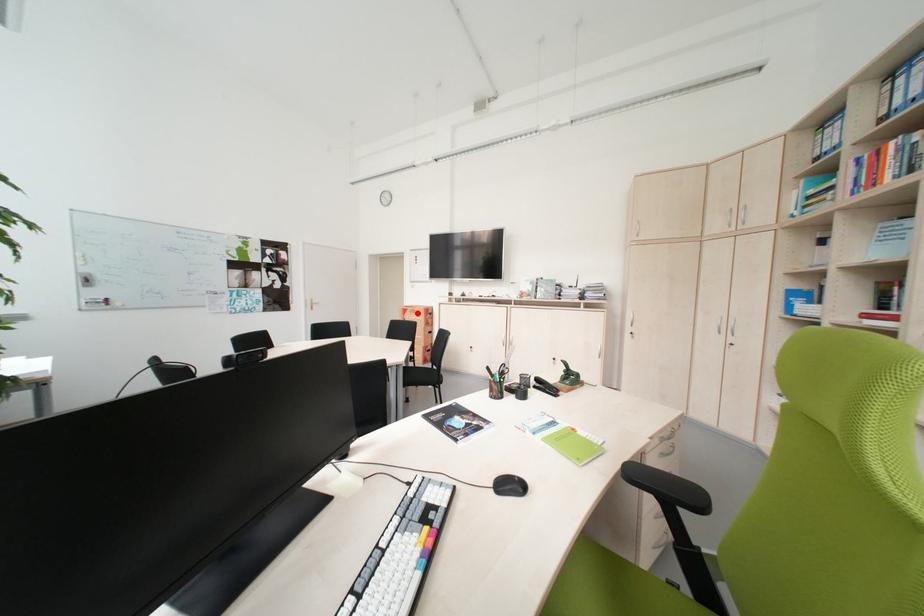
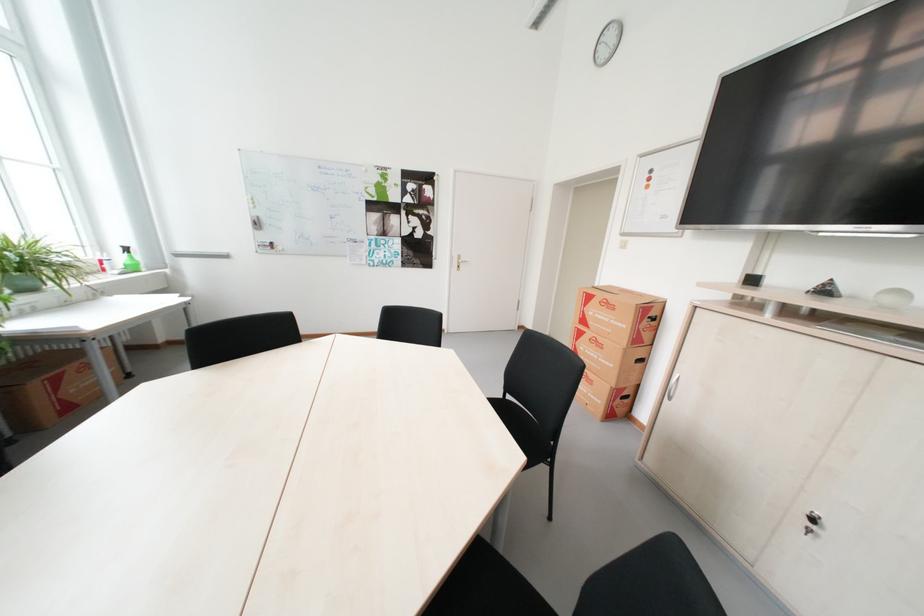
In the second image, find the point that corresponds to the highlighted location in the first image.

(604, 302)